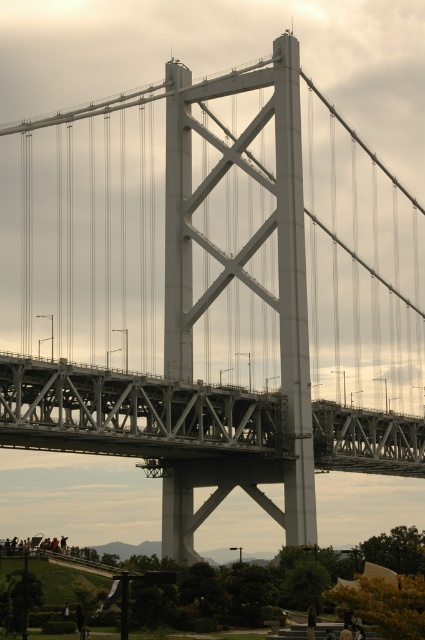
Question: Which of the following is the farthest from the observer?

Choices:
 (A) (382, 467)
 (B) (308, 630)

Answer: (A)

Question: Is gray metallic bridge at center positioned in front of green grass at lower left?

Choices:
 (A) yes
 (B) no

Answer: (B)

Question: Can you confirm if gray metallic bridge at center is bigger than dark hair at lower center?

Choices:
 (A) no
 (B) yes

Answer: (B)

Question: Which point is farther to the camera?

Choices:
 (A) green grass at lower left
 (B) dark hair at lower center
 (C) gray metallic bridge at center

Answer: (B)

Question: Considering the real-world distances, which object is farthest from the gray metallic bridge at center?

Choices:
 (A) green grass at lower left
 (B) dark hair at lower center

Answer: (B)

Question: Considering the relative positions of green grass at lower left and dark hair at lower center in the image provided, where is green grass at lower left located with respect to dark hair at lower center?

Choices:
 (A) below
 (B) above

Answer: (B)